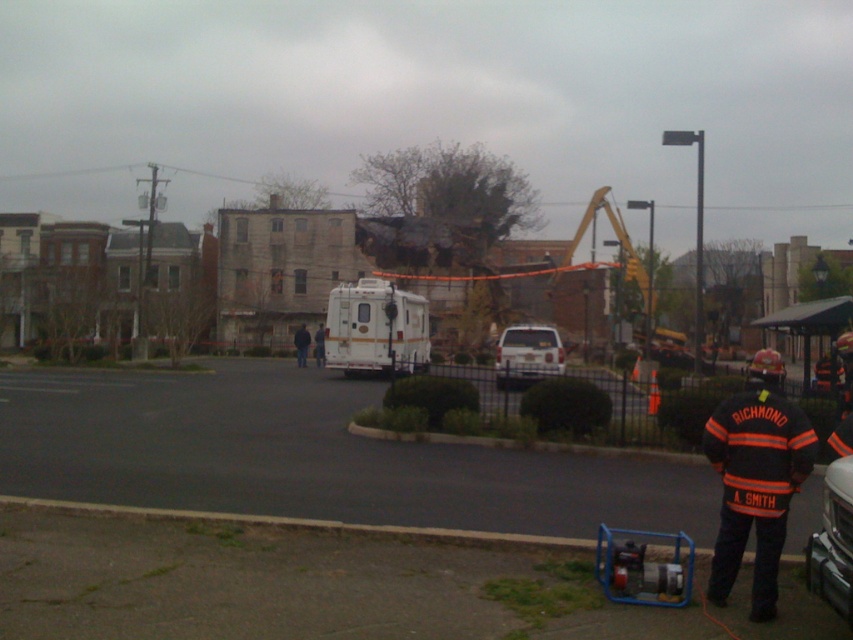
Question: Which of the following is the closest to the observer?

Choices:
 (A) white matte van at center
 (B) white matte ambulance at center
 (C) orange reflective jacket at lower right

Answer: (C)

Question: Which point is closer to the camera?

Choices:
 (A) orange reflective jacket at lower right
 (B) white matte ambulance at center
 (C) white matte van at center

Answer: (A)

Question: Does white matte ambulance at center have a greater width compared to orange reflective jacket at center?

Choices:
 (A) no
 (B) yes

Answer: (A)

Question: Which point is farther to the camera?

Choices:
 (A) orange reflective jacket at center
 (B) white matte van at center
 (C) orange reflective jacket at lower right
 (D) white matte ambulance at center

Answer: (A)

Question: Is orange reflective jacket at lower right further to the viewer compared to orange reflective jacket at center?

Choices:
 (A) no
 (B) yes

Answer: (A)

Question: Does white matte van at center have a larger size compared to orange reflective jacket at center?

Choices:
 (A) yes
 (B) no

Answer: (A)